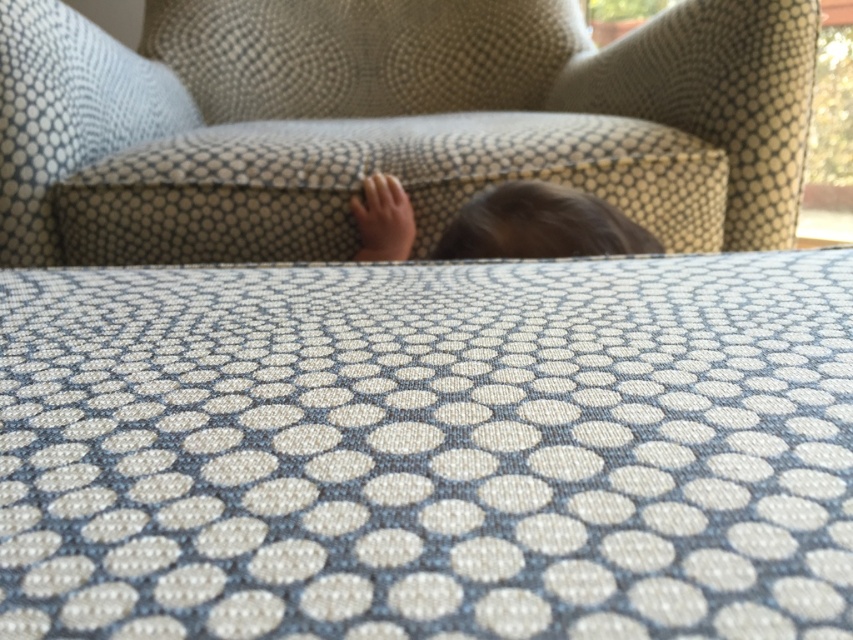
Is textured fabric armchair at center closer to the viewer compared to matte skin hand at center?

Yes.

Is textured fabric armchair at center thinner than matte skin hand at center?

Incorrect, textured fabric armchair at center's width is not less than matte skin hand at center's.

Who is more forward, (160, 193) or (396, 211)?

Point (396, 211)

Where is `textured fabric armchair at center`? The height and width of the screenshot is (640, 853). textured fabric armchair at center is located at coordinates (389, 122).

Does textured fabric armchair at center lie behind brown hair at center?

That is True.

Which is in front, point (529, 148) or point (448, 236)?

Positioned in front is point (448, 236).

Where is `textured fabric armchair at center`? This screenshot has height=640, width=853. textured fabric armchair at center is located at coordinates (389, 122).

Is brown hair at center wider than matte skin hand at center?

Indeed, brown hair at center has a greater width compared to matte skin hand at center.

Which of these two, brown hair at center or matte skin hand at center, stands taller?

With more height is brown hair at center.

Describe the element at coordinates (540, 225) in the screenshot. This screenshot has width=853, height=640. I see `brown hair at center` at that location.

At what (x,y) coordinates should I click in order to perform the action: click on brown hair at center. Please return your answer as a coordinate pair (x, y). Looking at the image, I should click on (540, 225).